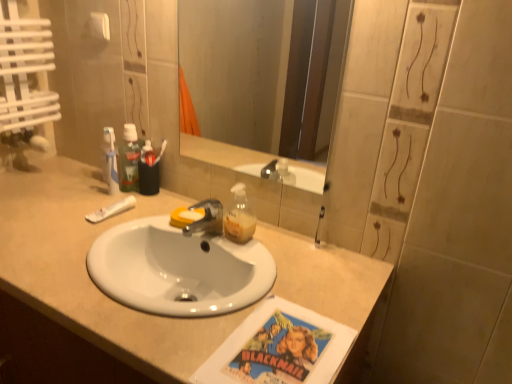
The image size is (512, 384). In order to click on vacant space in front of white matte tube at left in this screenshot , I will do `click(75, 242)`.